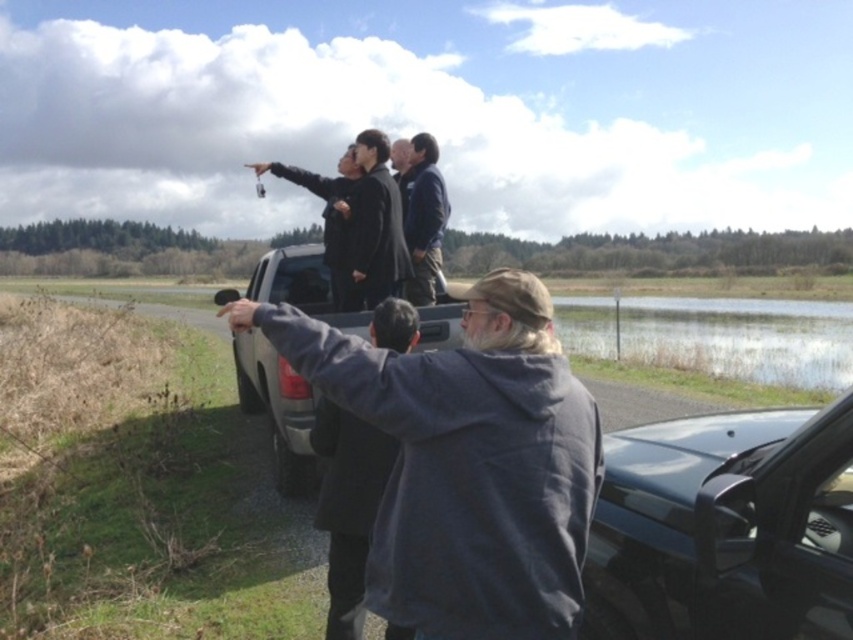
Does dark gray hoodie at center appear on the right side of dark blue jacket at center?

No, dark gray hoodie at center is not to the right of dark blue jacket at center.

Can you confirm if dark gray hoodie at center is smaller than dark blue jacket at center?

No, dark gray hoodie at center is not smaller than dark blue jacket at center.

Locate an element on the screen. The height and width of the screenshot is (640, 853). dark gray hoodie at center is located at coordinates (347, 506).

Which of these two, dark gray jacket at center or dark blue jacket at center, stands taller?

Standing taller between the two is dark gray jacket at center.

Is point (376, 154) less distant than point (432, 262)?

Yes, point (376, 154) is closer to viewer.

Image resolution: width=853 pixels, height=640 pixels. Find the location of `dark gray jacket at center`. dark gray jacket at center is located at coordinates (x=374, y=227).

The width and height of the screenshot is (853, 640). I want to click on dark gray jacket at center, so click(374, 227).

Between point (366, 540) and point (358, 209), which one is positioned in front?

Point (366, 540)

Which is below, dark gray hoodie at center or dark gray jacket at center?

dark gray hoodie at center

Who is more distant from viewer, (355, 464) or (363, 230)?

The point (363, 230) is behind.

I want to click on dark gray hoodie at center, so click(x=347, y=506).